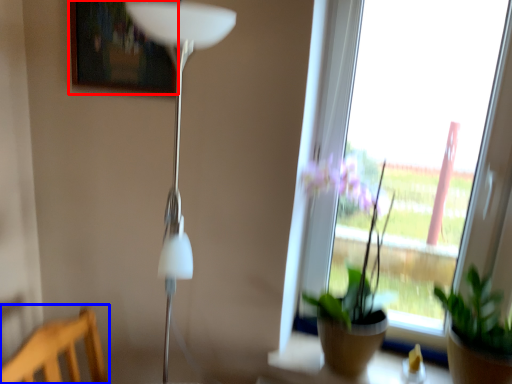
Question: Which point is further to the camera, picture frame (highlighted by a red box) or furniture (highlighted by a blue box)?

Choices:
 (A) picture frame
 (B) furniture

Answer: (A)